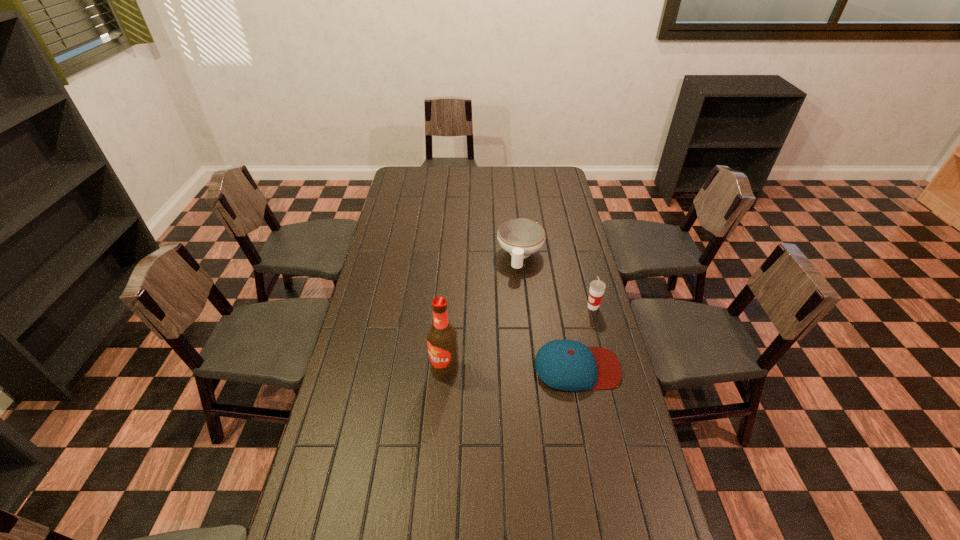
This screenshot has width=960, height=540. Identify the location of vacant area at the near right corner of the desktop. (652, 519).

The height and width of the screenshot is (540, 960). Find the location of `free space between the second farthest object and the farthest object`. free space between the second farthest object and the farthest object is located at coordinates (557, 281).

The image size is (960, 540). Identify the location of vacant space that's between the chinaware and the leftmost object. (483, 313).

I want to click on free space that is in between the third nearest object and the farthest object, so click(x=557, y=281).

This screenshot has width=960, height=540. Find the location of `free spot between the baseball cap and the cup`. free spot between the baseball cap and the cup is located at coordinates (585, 337).

The width and height of the screenshot is (960, 540). In order to click on free space between the tallest object and the chinaware in this screenshot , I will do `click(483, 313)`.

Locate an element on the screen. This screenshot has width=960, height=540. vacant point located between the chinaware and the third nearest object is located at coordinates (557, 281).

You are a GUI agent. You are given a task and a screenshot of the screen. Output one action in this format:
    pyautogui.click(x=<x>, y=<y>)
    Task: Click on the unoccupied area between the baseball cap and the second shortest object
    
    Given the screenshot: What is the action you would take?
    pyautogui.click(x=548, y=312)

At what (x,y) coordinates should I click in order to perform the action: click on free point between the second tallest object and the shortest object. Please return your answer as a coordinate pair (x, y). Looking at the image, I should click on (585, 337).

This screenshot has height=540, width=960. I want to click on unoccupied position between the shortest object and the third nearest object, so click(585, 337).